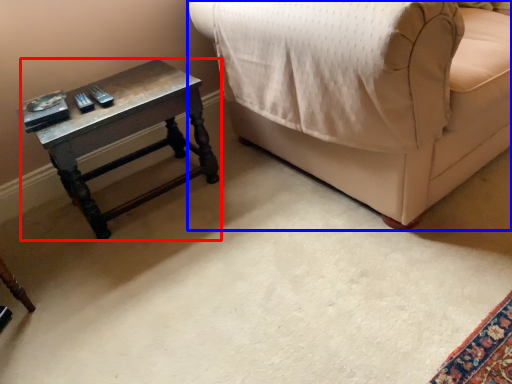
Question: Which point is closer to the camera, table (highlighted by a red box) or furniture (highlighted by a blue box)?

Choices:
 (A) table
 (B) furniture

Answer: (B)